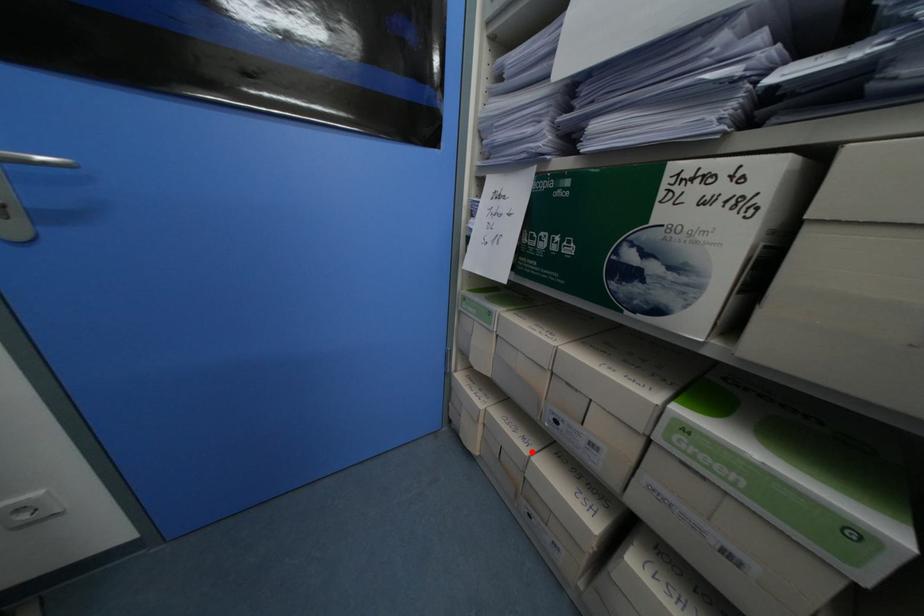
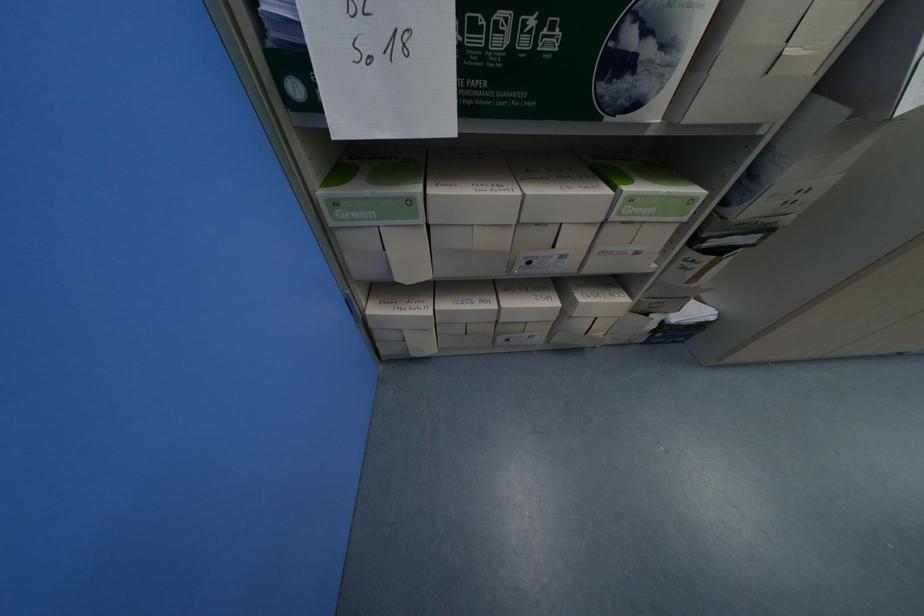
In the second image, find the point that corresponds to the highlighted location in the first image.

(500, 307)